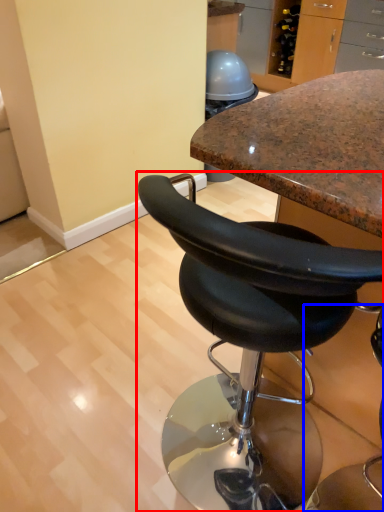
Question: Which of the following is the farthest to the observer, chair (highlighted by a red box) or chair (highlighted by a blue box)?

Choices:
 (A) chair
 (B) chair

Answer: (A)